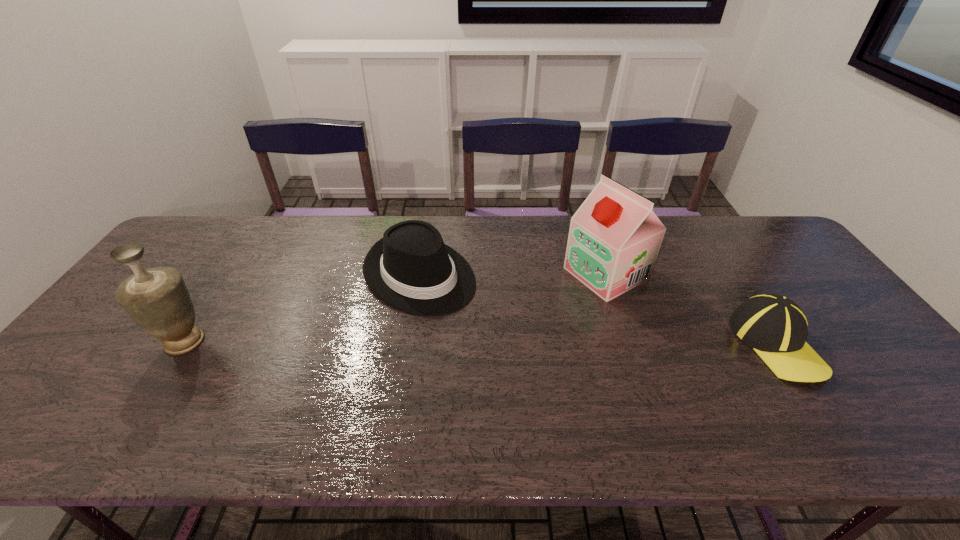
Find the location of `free space on the desktop that is between the urn and the shortest object and is positioned with the cap open on the second object from right to left`. free space on the desktop that is between the urn and the shortest object and is positioned with the cap open on the second object from right to left is located at coordinates tap(466, 343).

Identify the location of free spot on the desktop that is between the leftmost object and the shortest object and is positioned on the front-facing side of the second object from left to right. This screenshot has height=540, width=960. (507, 343).